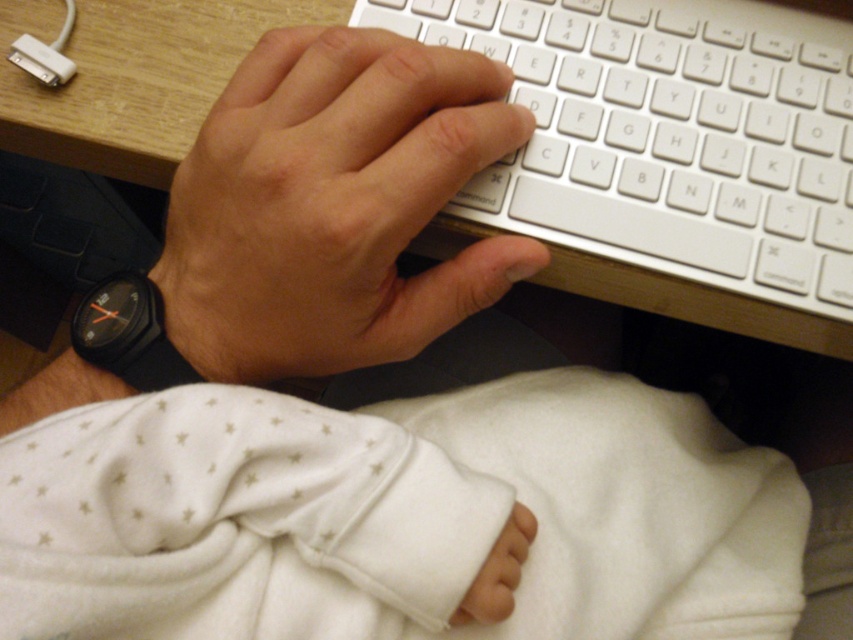
Identify the location of smooth skin hand at center. (334, 205).

Can you confirm if smooth skin hand at center is positioned to the left of wooden at upper center?

Indeed, smooth skin hand at center is positioned on the left side of wooden at upper center.

Who is more forward, [467,76] or [653,292]?

Point [467,76] is more forward.

The height and width of the screenshot is (640, 853). In order to click on smooth skin hand at center in this screenshot , I will do `click(334, 205)`.